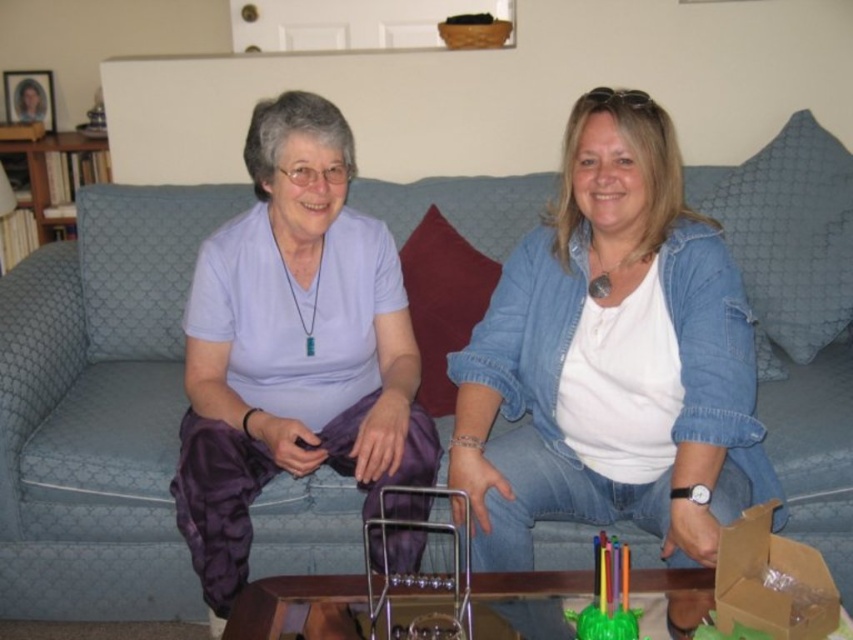
You are standing in front of the sofa and want to pick up an object from the coffee table. There are two points marked on the table where objects might be placed. The first point is at coordinates point (412, 554) and the second is at point (595, 573). Which of these points is closer to you?

Point (412, 554) is closer to you because it is further to the viewer than point (595, 573).

You are a photographer trying to capture a closeup of the translucent plastic toy at center without including the purple satin pants at center in the frame. Is this possible given their positions?

The purple satin pants at center is further to the viewer than the translucent plastic toy at center, so the pants are closer to the photographer. This means the toy is behind the pants, making it impossible to capture the toy without the pants in the frame.

You are a fashion designer observing the scene. You need to decide whether the white matte shirt at center can be seen without obstruction from the translucent plastic toy at center. Based on their positions, what do you think?

The white matte shirt at center is above the translucent plastic toy at center, so yes, it can be seen without obstruction from the translucent plastic toy at center.